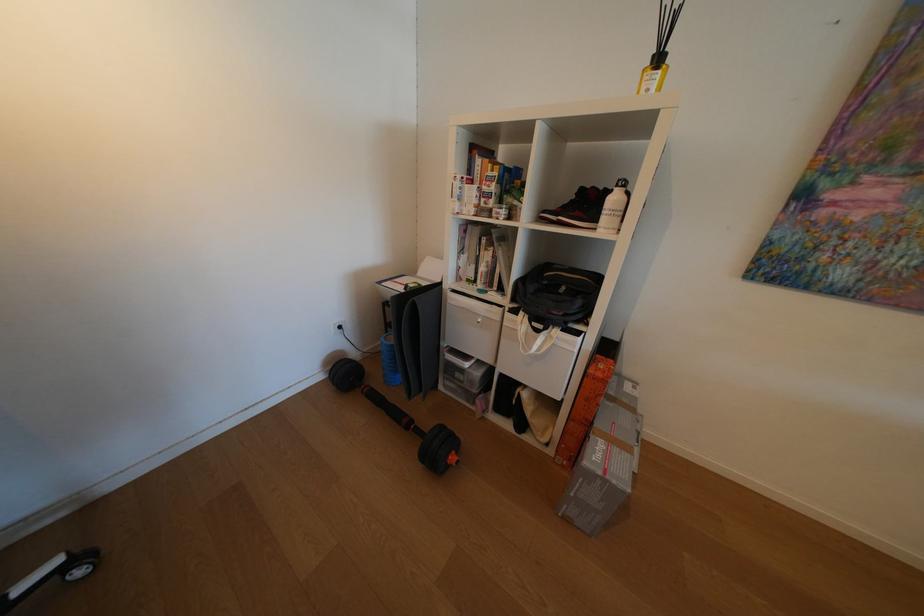
Which object does [578,208] point to?

It refers to a red and black shoe.